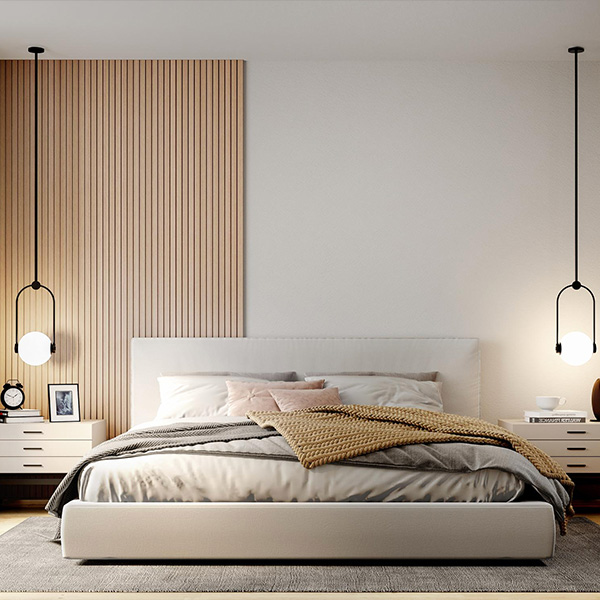
At what (x,y) coordinates should I click in order to perform the action: click on alarm clock. Please return your answer as a coordinate pair (x, y). This screenshot has width=600, height=600. Looking at the image, I should click on (18, 393).